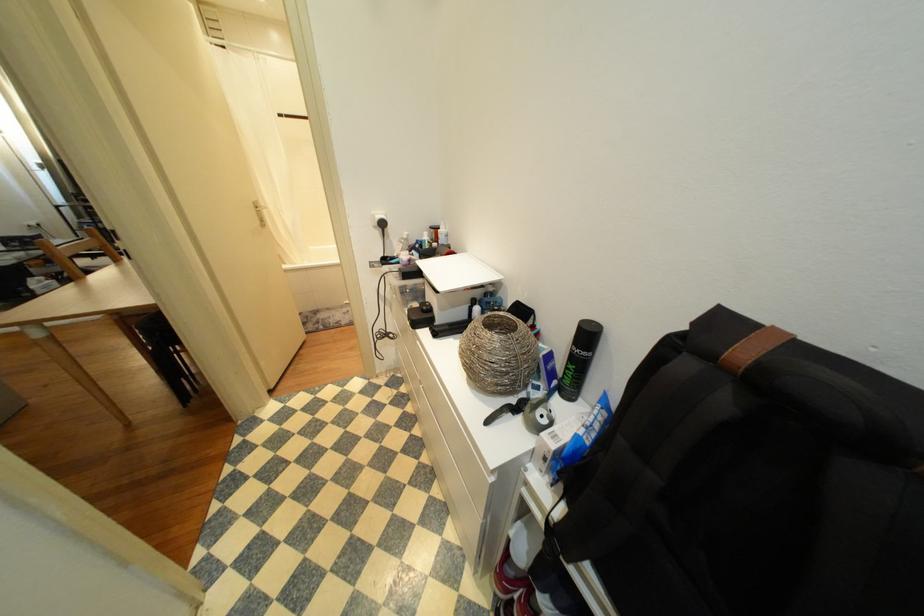
Where would you lift the white closed laptop? Please return your answer as a coordinate pair (x, y).

(456, 272)